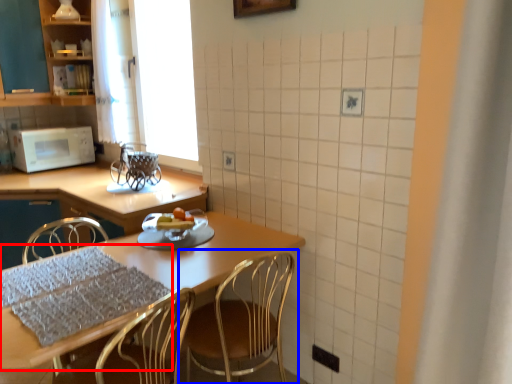
Question: Which of the following is the closest to the observer, tablecloth (highlighted by a red box) or chair (highlighted by a blue box)?

Choices:
 (A) tablecloth
 (B) chair

Answer: (B)